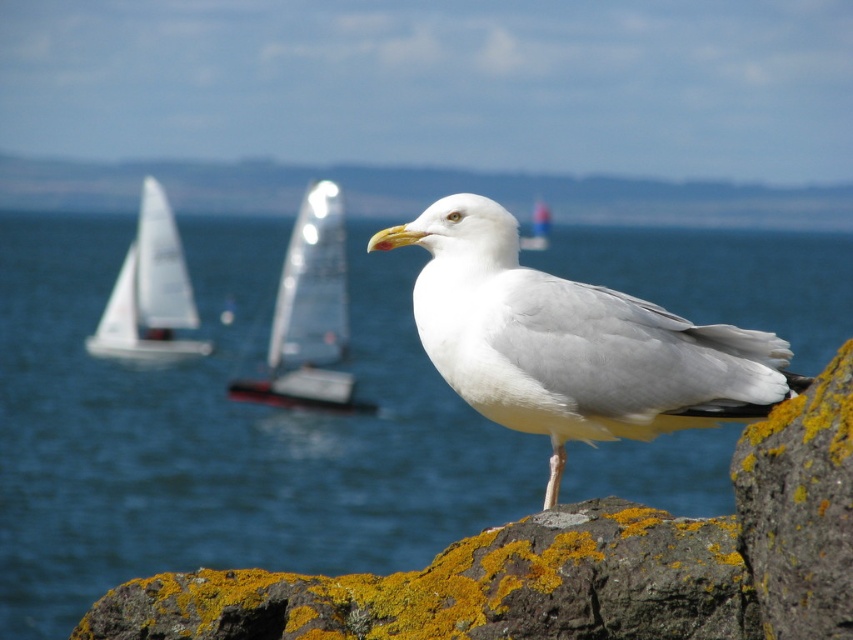
Question: Which object is the closest to the white feathered bird at center?

Choices:
 (A) white sailboat at left
 (B) blue water at center
 (C) white glossy sailboat at center
 (D) translucent white sailboat at center

Answer: (C)

Question: Is translucent white sailboat at center behind white glossy sailboat at center?

Choices:
 (A) yes
 (B) no

Answer: (A)

Question: Does blue water at center have a smaller size compared to white sailboat at left?

Choices:
 (A) no
 (B) yes

Answer: (A)

Question: Is white feathered bird at center wider than translucent white sailboat at center?

Choices:
 (A) no
 (B) yes

Answer: (A)

Question: Which of the following is the farthest from the observer?

Choices:
 (A) white glossy sailboat at center
 (B) white sailboat at left

Answer: (B)

Question: Which of these objects is positioned closest to the white sailboat at left?

Choices:
 (A) blue water at center
 (B) white feathered bird at center
 (C) translucent white sailboat at center
 (D) white glossy sailboat at center

Answer: (C)